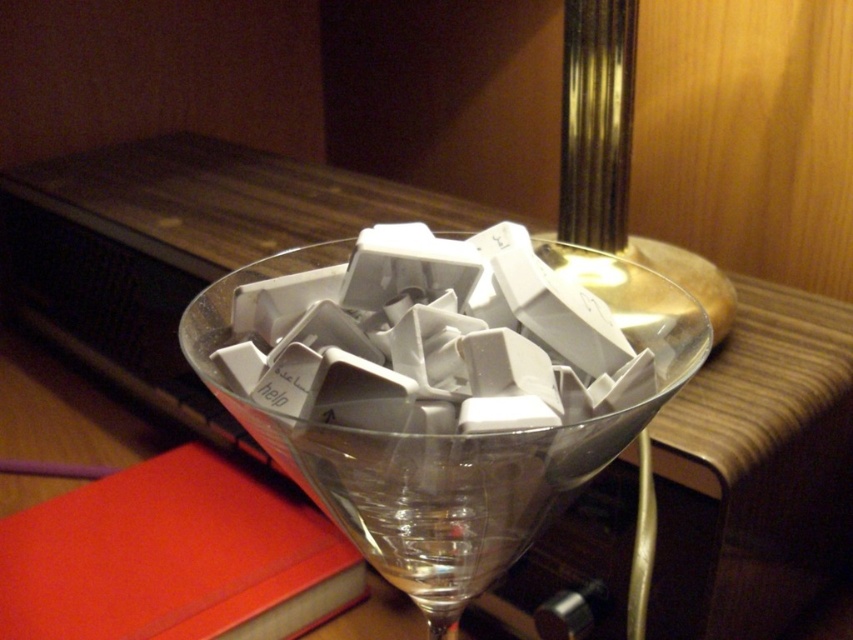
Is the position of transparent glass at center more distant than that of red matte book at lower left?

No, transparent glass at center is closer to the viewer.

Who is positioned more to the right, transparent glass at center or red matte book at lower left?

Positioned to the right is transparent glass at center.

Where is `transparent glass at center`? The width and height of the screenshot is (853, 640). transparent glass at center is located at coordinates (437, 451).